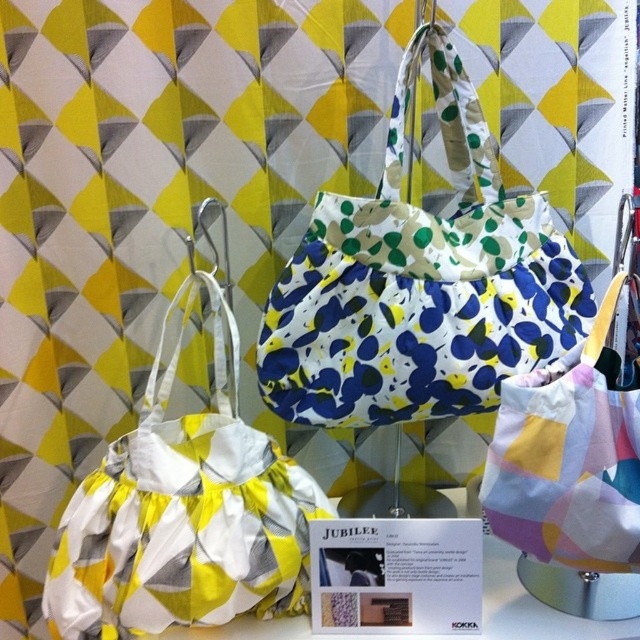
Question: Does white satin bag at left have a greater width compared to yellow and white fabric bag at center?

Choices:
 (A) yes
 (B) no

Answer: (A)

Question: Which point is farther to the camera?

Choices:
 (A) yellow and white fabric bag at center
 (B) printed fabric tote bag at center
 (C) white satin bag at left

Answer: (B)

Question: Which object appears closest to the camera in this image?

Choices:
 (A) printed fabric tote bag at center
 (B) white satin bag at left

Answer: (B)

Question: Can you confirm if white satin bag at left is thinner than yellow and white fabric bag at center?

Choices:
 (A) yes
 (B) no

Answer: (B)

Question: Estimate the real-world distances between objects in this image. Which object is farther from the printed fabric tote bag at center?

Choices:
 (A) yellow and white fabric bag at center
 (B) white satin bag at left

Answer: (B)

Question: Where is white satin bag at left located in relation to yellow and white fabric bag at center in the image?

Choices:
 (A) above
 (B) below

Answer: (B)